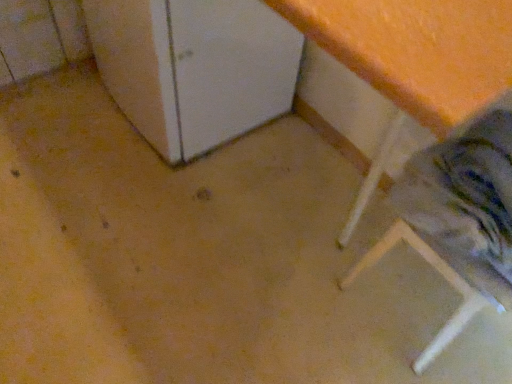
Question: Does wooden step stool at lower right have a lesser height compared to white matte cabinet at upper left?

Choices:
 (A) yes
 (B) no

Answer: (A)

Question: From the image's perspective, is wooden step stool at lower right below white matte cabinet at upper left?

Choices:
 (A) yes
 (B) no

Answer: (A)

Question: Is wooden step stool at lower right to the right of white matte cabinet at upper left from the viewer's perspective?

Choices:
 (A) yes
 (B) no

Answer: (A)

Question: From the image's perspective, is wooden step stool at lower right above white matte cabinet at upper left?

Choices:
 (A) no
 (B) yes

Answer: (A)

Question: Does wooden step stool at lower right lie in front of white matte cabinet at upper left?

Choices:
 (A) no
 (B) yes

Answer: (B)

Question: Could you tell me if wooden step stool at lower right is turned towards white matte cabinet at upper left?

Choices:
 (A) no
 (B) yes

Answer: (A)

Question: Is wooden step stool at lower right completely or partially inside white matte cabinet at upper left?

Choices:
 (A) no
 (B) yes

Answer: (A)

Question: Is white matte cabinet at upper left outside of wooden step stool at lower right?

Choices:
 (A) yes
 (B) no

Answer: (A)

Question: Does white matte cabinet at upper left lie in front of wooden step stool at lower right?

Choices:
 (A) no
 (B) yes

Answer: (A)

Question: Is white matte cabinet at upper left to the right of wooden step stool at lower right from the viewer's perspective?

Choices:
 (A) no
 (B) yes

Answer: (A)

Question: From the image's perspective, is white matte cabinet at upper left below wooden step stool at lower right?

Choices:
 (A) no
 (B) yes

Answer: (A)

Question: Is the depth of white matte cabinet at upper left greater than that of wooden step stool at lower right?

Choices:
 (A) yes
 (B) no

Answer: (A)

Question: From a real-world perspective, is wooden step stool at lower right positioned above or below white matte cabinet at upper left?

Choices:
 (A) above
 (B) below

Answer: (B)